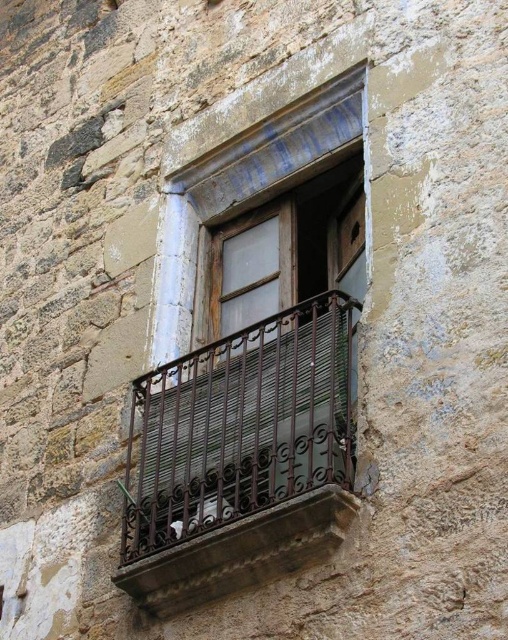
You are a maintenance worker assessing the structural integrity of the building. You notice the rusty metal balcony at center and the brown wrought iron at center. Which of these two structures is more likely to require immediate attention based on their spatial relationship?

The rusty metal balcony at center might be wider than brown wrought iron at center, so it requires more immediate attention due to its larger size and potential structural concerns.

You are a maintenance worker inspecting the building. You notice the rusty metal balcony at center and the brown wrought iron at center. Which of these two structures requires more material to repair due to its size?

The rusty metal balcony at center requires more material to repair because it is bigger than the brown wrought iron at center.